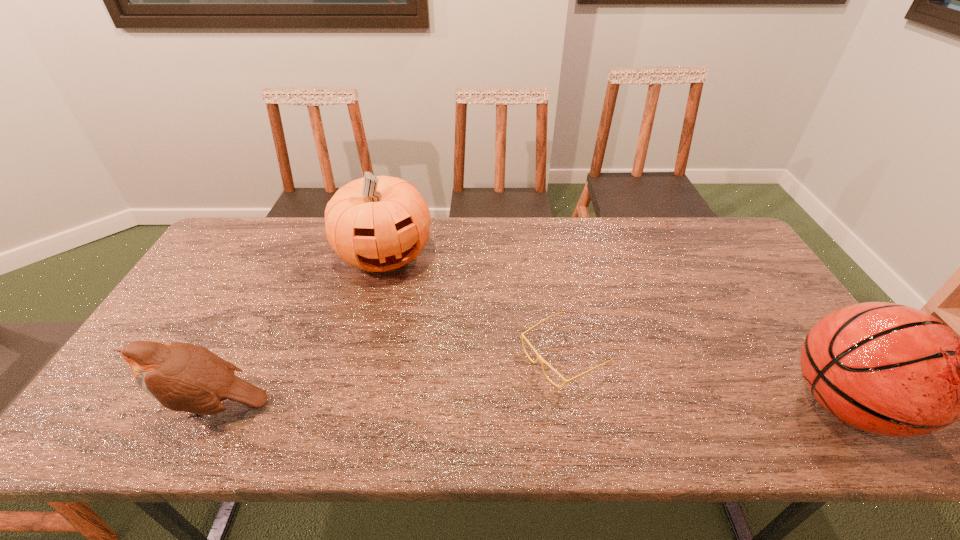
Image resolution: width=960 pixels, height=540 pixels. I want to click on free space on the desktop that is between the leftmost object and the rightmost object and is positioned in front of the lenses of the shortest object, so click(479, 405).

The width and height of the screenshot is (960, 540). In order to click on free space on the desktop that is between the second shortest object and the basketball and is positioned on the front-facing side of the second object from left to right in this screenshot , I will do `click(444, 405)`.